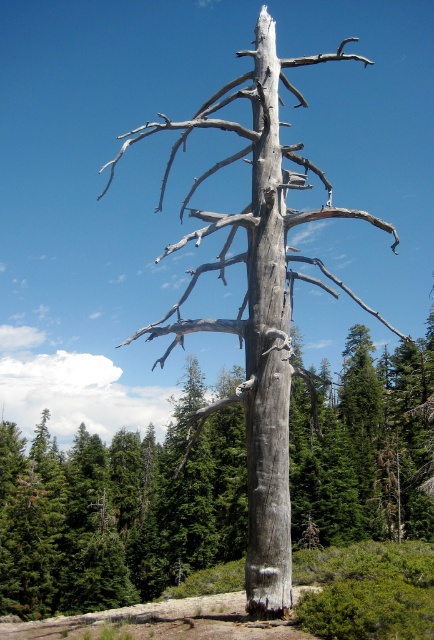
Can you confirm if gray textured trunk at center is bigger than gray bark tree at center?

No.

Can you confirm if gray textured trunk at center is positioned below gray bark tree at center?

Indeed, gray textured trunk at center is positioned under gray bark tree at center.

Which is in front, point (431, 524) or point (273, 464)?

Point (273, 464) is in front.

Identify the location of gray textured trunk at center. coord(118,509).

Which of these two, gray bark tree at center or gray rough bark tree trunk at center, stands shorter?

gray rough bark tree trunk at center

Looking at this image, is gray bark tree at center shorter than gray rough bark tree trunk at center?

Incorrect, gray bark tree at center's height does not fall short of gray rough bark tree trunk at center's.

This screenshot has width=434, height=640. What do you see at coordinates (256, 296) in the screenshot?
I see `gray bark tree at center` at bounding box center [256, 296].

Find the location of `gray bark tree at center`. gray bark tree at center is located at coordinates (256, 296).

Who is higher up, gray textured trunk at center or gray rough bark tree trunk at center?

gray rough bark tree trunk at center is higher up.

Based on the photo, can you confirm if gray textured trunk at center is positioned below gray rough bark tree trunk at center?

Yes.

This screenshot has width=434, height=640. Identify the location of gray textured trunk at center. pos(118,509).

This screenshot has width=434, height=640. Find the location of `gray textured trunk at center`. gray textured trunk at center is located at coordinates (118, 509).